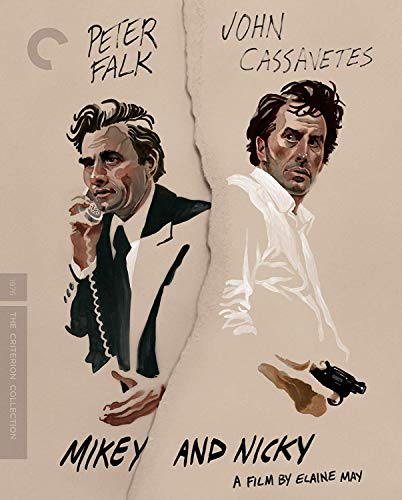
The height and width of the screenshot is (500, 402). I want to click on artistic film poster, so click(x=197, y=63).